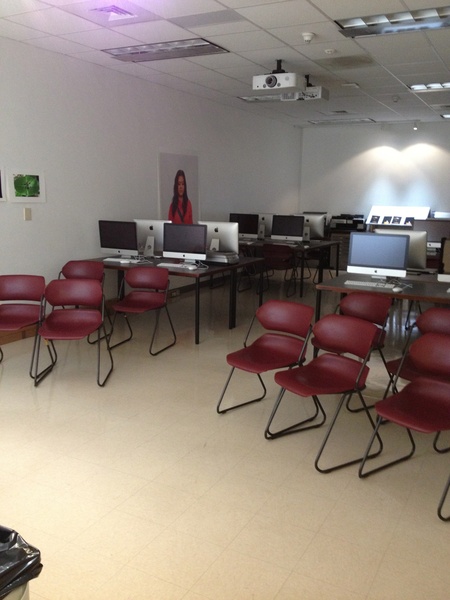
Locate an element on the screen. This screenshot has width=450, height=600. projecter is located at coordinates (284, 77).